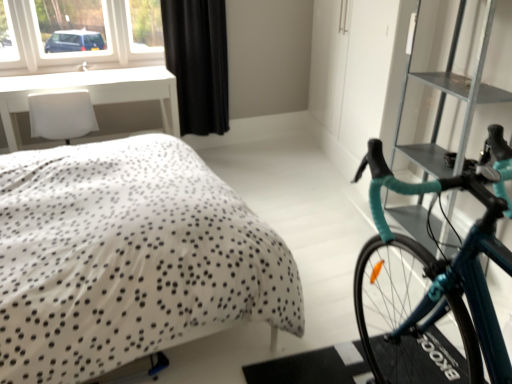
This screenshot has height=384, width=512. What do you see at coordinates (198, 62) in the screenshot?
I see `black textured curtain at upper center` at bounding box center [198, 62].

What do you see at coordinates (445, 98) in the screenshot?
I see `metallic gray bookshelf at right` at bounding box center [445, 98].

Where is `white dotted fabric bed at center`? The width and height of the screenshot is (512, 384). white dotted fabric bed at center is located at coordinates (127, 257).

Locate an element on the screen. This screenshot has width=512, height=384. white plastic window at upper left is located at coordinates (74, 52).

What do you see at coordinates (432, 285) in the screenshot? I see `teal glossy bicycle at right` at bounding box center [432, 285].

Identify the location of black textured curtain at upper center. (198, 62).

Is white plastic window at upper left behind black textured curtain at upper center?

No.

Which of these two, white plastic window at upper left or black textured curtain at upper center, stands taller?

black textured curtain at upper center is taller.

Consider the image. Is white plastic window at upper left directly adjacent to black textured curtain at upper center?

No, white plastic window at upper left is not in contact with black textured curtain at upper center.

Find the location of a particular element. window on the left of black textured curtain at upper center is located at coordinates (74, 52).

From the image's perspective, which one is positioned higher, teal glossy bicycle at right or white glossy table at upper left?

From the image's view, white glossy table at upper left is above.

From a real-world perspective, is teal glossy bicycle at right physically located above or below white glossy table at upper left?

From a real-world perspective, teal glossy bicycle at right is physically above white glossy table at upper left.

Can you tell me how much teal glossy bicycle at right and white glossy table at upper left differ in facing direction?

169 degrees.

Between white glossy table at upper left and black textured curtain at upper center, which one appears on the left side from the viewer's perspective?

From the viewer's perspective, white glossy table at upper left appears more on the left side.

Image resolution: width=512 pixels, height=384 pixels. Find the location of `table below the black textured curtain at upper center (from the image's perspective)`. table below the black textured curtain at upper center (from the image's perspective) is located at coordinates (91, 93).

Looking at this image, what's the angular difference between white glossy table at upper left and black textured curtain at upper center's facing directions?

The angular difference between white glossy table at upper left and black textured curtain at upper center is 1.22 degrees.

Is white glossy table at upper left inside the boundaries of black textured curtain at upper center, or outside?

The correct answer is: outside.

Considering the relative positions of white glossy table at upper left and white dotted fabric bed at center in the image provided, is white glossy table at upper left to the left of white dotted fabric bed at center from the viewer's perspective?

Yes.

Is white glossy table at upper left situated inside white dotted fabric bed at center or outside?

The correct answer is: outside.

Which is in front, white glossy table at upper left or white dotted fabric bed at center?

white dotted fabric bed at center is closer to the camera.

Locate an element on the screen. Image resolution: width=512 pixels, height=384 pixels. table above the white dotted fabric bed at center (from the image's perspective) is located at coordinates (91, 93).

Considering the relative sizes of metallic gray bookshelf at right and black textured curtain at upper center in the image provided, is metallic gray bookshelf at right smaller than black textured curtain at upper center?

Actually, metallic gray bookshelf at right might be larger than black textured curtain at upper center.

Is metallic gray bookshelf at right not near black textured curtain at upper center?

Yes, metallic gray bookshelf at right and black textured curtain at upper center are quite far apart.

Which is less distant, (x=464, y=128) or (x=226, y=123)?

Point (x=464, y=128).

Is black textured curtain at upper center surrounded by metallic gray bookshelf at right?

No, black textured curtain at upper center is not surrounded by metallic gray bookshelf at right.

Is point (195, 109) positioned in front of point (52, 265)?

No.

Is black textured curtain at upper center taller or shorter than white dotted fabric bed at center?

black textured curtain at upper center is taller than white dotted fabric bed at center.

Can you confirm if black textured curtain at upper center is thinner than white dotted fabric bed at center?

Indeed, black textured curtain at upper center has a lesser width compared to white dotted fabric bed at center.

Would you say black textured curtain at upper center is to the left or to the right of white dotted fabric bed at center in the picture?

In the image, black textured curtain at upper center appears on the right side of white dotted fabric bed at center.

Considering the sizes of metallic gray bookshelf at right and teal glossy bicycle at right in the image, is metallic gray bookshelf at right taller or shorter than teal glossy bicycle at right?

In the image, metallic gray bookshelf at right appears to be taller than teal glossy bicycle at right.

Is metallic gray bookshelf at right aimed at teal glossy bicycle at right?

No.

Can you confirm if metallic gray bookshelf at right is smaller than teal glossy bicycle at right?

Yes, metallic gray bookshelf at right is smaller than teal glossy bicycle at right.

From a real-world perspective, is metallic gray bookshelf at right on top of teal glossy bicycle at right?

Yes, from a real-world perspective, metallic gray bookshelf at right is over teal glossy bicycle at right

Where is `curtain on the right of white plastic window at upper left`? The width and height of the screenshot is (512, 384). curtain on the right of white plastic window at upper left is located at coordinates (198, 62).

Where is `bicycle below the white glossy table at upper left (from the image's perspective)`? This screenshot has width=512, height=384. bicycle below the white glossy table at upper left (from the image's perspective) is located at coordinates click(432, 285).

When comparing their distances from metallic gray bookshelf at right, does teal glossy bicycle at right or white dotted fabric bed at center seem further?

white dotted fabric bed at center.

From the image, which object appears to be farther from black textured curtain at upper center, white glossy table at upper left or white dotted fabric bed at center?

white dotted fabric bed at center is further to black textured curtain at upper center.

Estimate the real-world distances between objects in this image. Which object is further from white plastic window at upper left, white glossy table at upper left or black textured curtain at upper center?

black textured curtain at upper center is positioned further to the anchor white plastic window at upper left.

Estimate the real-world distances between objects in this image. Which object is further from white dotted fabric bed at center, metallic gray bookshelf at right or white glossy table at upper left?

Among the two, metallic gray bookshelf at right is located further to white dotted fabric bed at center.

Looking at this image, estimate the real-world distances between objects in this image. Which object is closer to white plastic window at upper left, teal glossy bicycle at right or white glossy table at upper left?

white glossy table at upper left is positioned closer to the anchor white plastic window at upper left.

Estimate the real-world distances between objects in this image. Which object is further from white glossy table at upper left, teal glossy bicycle at right or white dotted fabric bed at center?

teal glossy bicycle at right.

Based on their spatial positions, is black textured curtain at upper center or teal glossy bicycle at right closer to white dotted fabric bed at center?

teal glossy bicycle at right is closer to white dotted fabric bed at center.

Considering their positions, is white glossy table at upper left positioned closer to white dotted fabric bed at center than teal glossy bicycle at right?

The object closer to white dotted fabric bed at center is teal glossy bicycle at right.

Find the location of a particular element. This screenshot has height=384, width=512. bed between teal glossy bicycle at right and white glossy table at upper left from front to back is located at coordinates (127, 257).

Identify the location of window between white dotted fabric bed at center and black textured curtain at upper center along the z-axis. The height and width of the screenshot is (384, 512). (74, 52).

Identify the location of bed between teal glossy bicycle at right and white plastic window at upper left in the front-back direction. The image size is (512, 384). (127, 257).

Where is `window between teal glossy bicycle at right and black textured curtain at upper center from front to back`? The image size is (512, 384). window between teal glossy bicycle at right and black textured curtain at upper center from front to back is located at coordinates (74, 52).